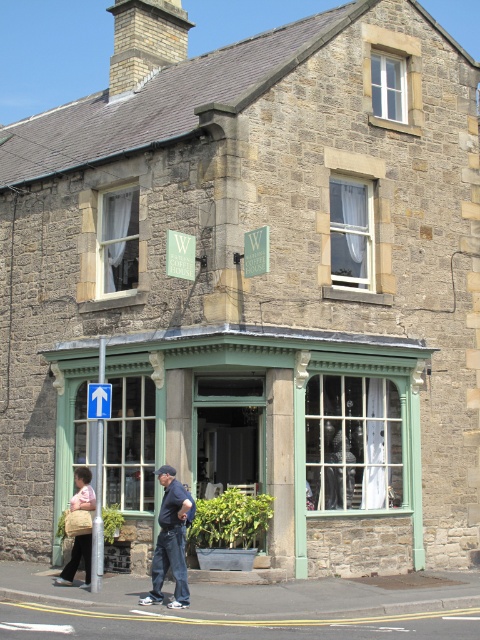
Can you confirm if green glass storefront at lower left is positioned to the right of gray asphalt at lower center?

No, green glass storefront at lower left is not to the right of gray asphalt at lower center.

Between green glass storefront at lower left and gray asphalt at lower center, which one is positioned higher?

green glass storefront at lower left

Find the location of a particular element. This screenshot has width=480, height=640. green glass storefront at lower left is located at coordinates (291, 412).

Which is behind, point (310, 632) or point (92, 385)?

Point (92, 385)

Does gray asphalt at lower center appear over blue plastic arrow at upper left?

Actually, gray asphalt at lower center is below blue plastic arrow at upper left.

Where is `gray asphalt at lower center`? This screenshot has height=640, width=480. gray asphalt at lower center is located at coordinates (226, 625).

Is green glass storefront at lower left shorter than blue plastic arrow at upper left?

No, green glass storefront at lower left is not shorter than blue plastic arrow at upper left.

Who is more forward, (311,413) or (88,401)?

Point (88,401)

Who is more forward, (112, 371) or (88, 397)?

Point (88, 397)

Locate an element on the screen. The width and height of the screenshot is (480, 640). green glass storefront at lower left is located at coordinates [x=291, y=412].